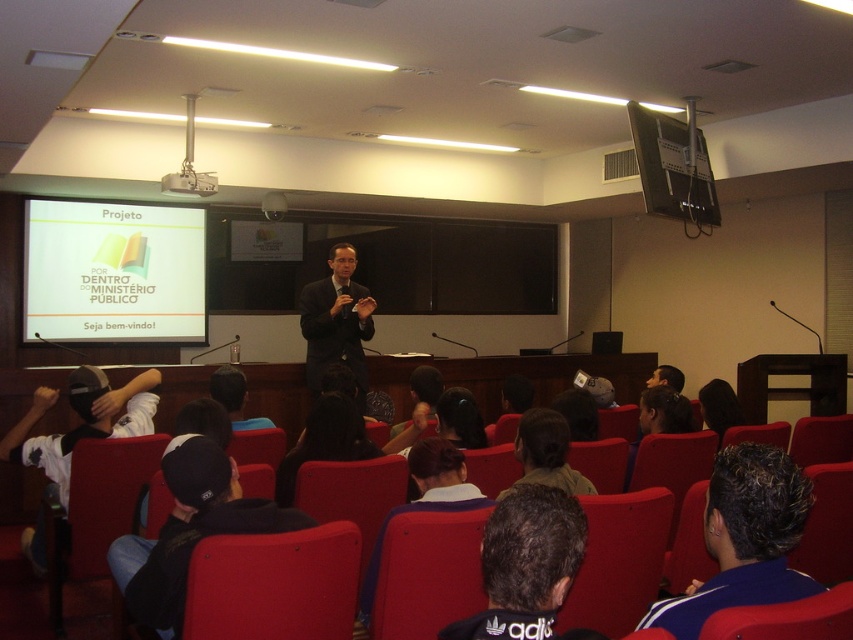
Looking at this image, you are a student in the classroom and you want to look at both the black fabric cap at lower left and the dark hair at center. Which one should you turn your head to the left to see?

The black fabric cap at lower left is positioned on the left side of dark hair at center, so to see it you would need to turn your head to the left.

You are a photographer standing at the back of the classroom. You want to take a photo of the black adidas shirt at center and the black hair at center so that both are in focus. The camera you are using has a depth of field that can cover objects up to 1 meter apart. Can you capture both subjects in focus with this camera?

The black adidas shirt at center and the black hair at center are 1.18 meters apart. Since the camera can only cover up to 1 meter, the distance between them exceeds the depth of field capability. Therefore, both subjects cannot be in focus simultaneously in the photo.